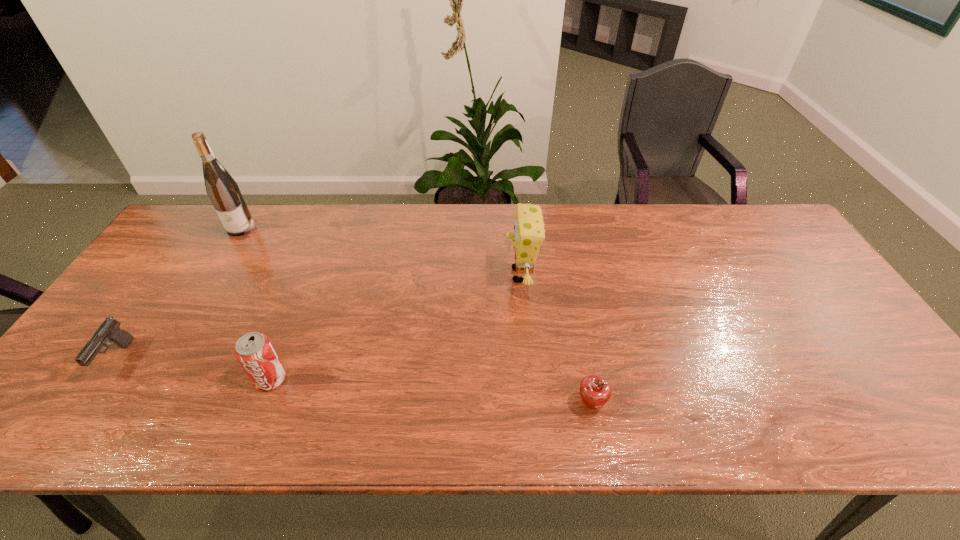
Find the location of `vacant space located 0.370m on the face of the second farthest object`. vacant space located 0.370m on the face of the second farthest object is located at coordinates (375, 275).

You are a GUI agent. You are given a task and a screenshot of the screen. Output one action in this format:
    pyautogui.click(x=<x>, y=<y>)
    Task: Click on the free space located 0.370m on the face of the second farthest object
    This screenshot has width=960, height=540.
    Given the screenshot: What is the action you would take?
    pyautogui.click(x=375, y=275)

Find the location of a particular element. The image size is (960, 540). vacant area situated 0.090m on the back of the third object from left to right is located at coordinates (287, 335).

The height and width of the screenshot is (540, 960). I want to click on vacant area situated 0.070m aim along the barrel of the pistol, so click(83, 409).

You are a GUI agent. You are given a task and a screenshot of the screen. Output one action in this format:
    pyautogui.click(x=<x>, y=<y>)
    Task: Click on the vacant space located 0.170m on the left of the rightmost object
    
    Given the screenshot: What is the action you would take?
    pyautogui.click(x=501, y=404)

This screenshot has width=960, height=540. What are the coordinates of `wine bottle that is at the far edge` in the screenshot? It's located at (223, 191).

At what (x,y) coordinates should I click in order to perform the action: click on sponge at the far edge. Please return your answer as a coordinate pair (x, y). Image resolution: width=960 pixels, height=540 pixels. Looking at the image, I should click on (529, 229).

Find the location of a particular element. object that is at the near edge is located at coordinates (595, 392).

Where is `wine bottle located at the left edge`? This screenshot has height=540, width=960. wine bottle located at the left edge is located at coordinates (223, 191).

At what (x,y) coordinates should I click in order to perform the action: click on pistol at the left edge. Please return your answer as a coordinate pair (x, y). This screenshot has width=960, height=540. Looking at the image, I should click on (110, 330).